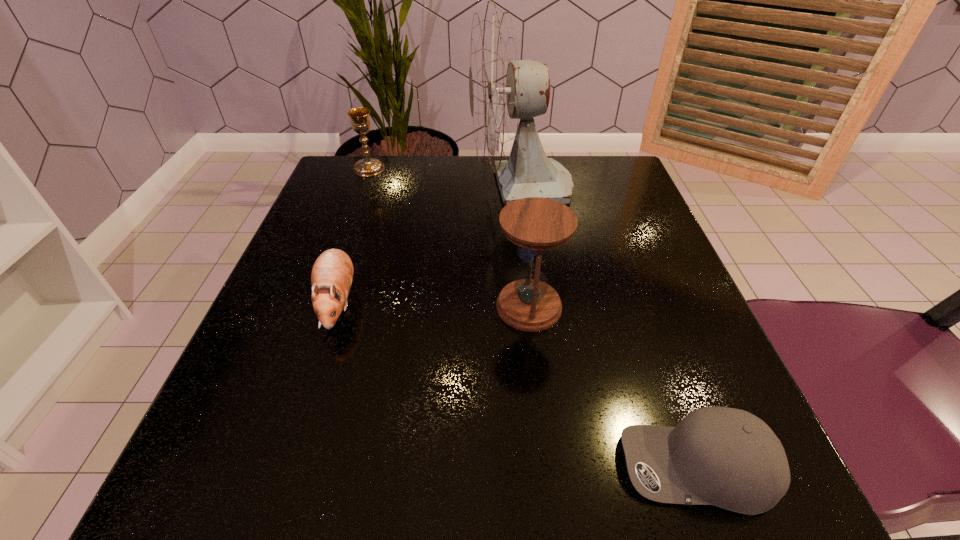
Locate which object ranks second in proximity to the hourglass. Please provide its 2D coordinates. Your answer should be formatted as a tuple, i.e. [(x, y)], where the tuple contains the x and y coordinates of a point satisfying the conditions above.

[(502, 89)]

Where is `vacant point that satisfies the following two spatial constraints: 1. in front of the fan to blow air; 2. on the front side of the second tallest object`? The width and height of the screenshot is (960, 540). vacant point that satisfies the following two spatial constraints: 1. in front of the fan to blow air; 2. on the front side of the second tallest object is located at coordinates (537, 307).

The width and height of the screenshot is (960, 540). In order to click on free space that satisfies the following two spatial constraints: 1. in front of the fan to blow air; 2. at the face of the hamster in this screenshot , I will do `click(536, 302)`.